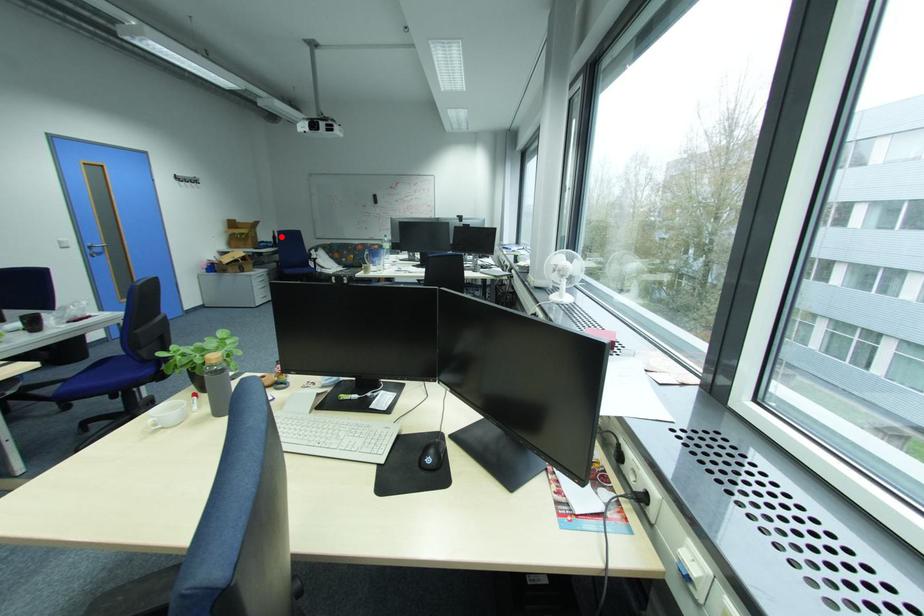
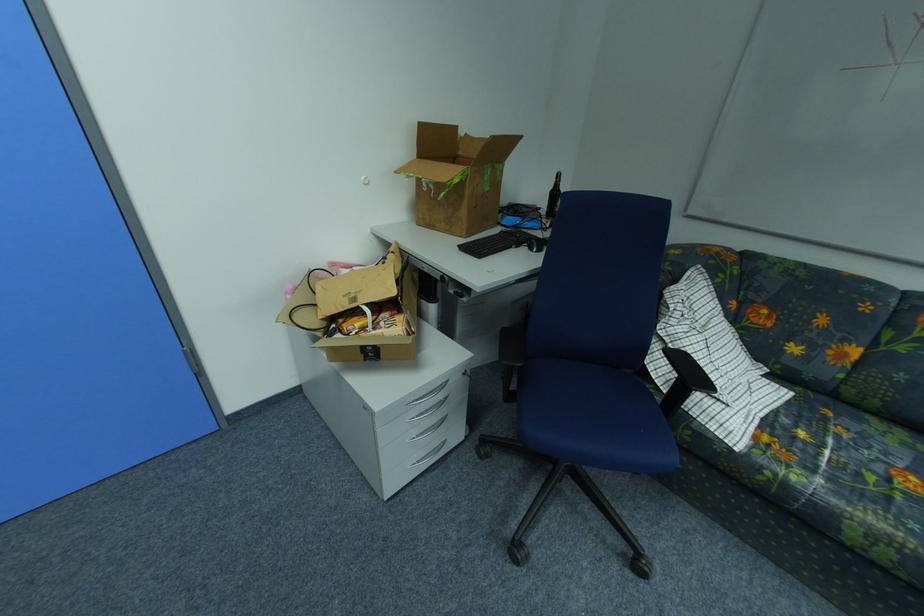
In the second image, find the point that corresponds to the highlighted location in the first image.

(560, 188)